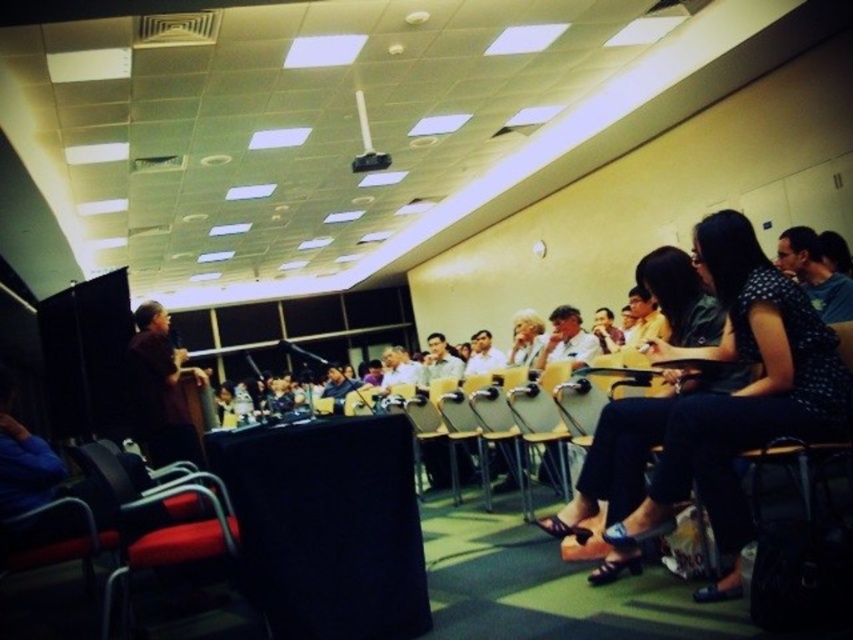
You are attending a meeting in this room and notice both the polka dot blouse at center and the red fabric chair at lower left. From your perspective sitting in the front row, which object is positioned to the right of the other?

The polka dot blouse at center is to the right of the red fabric chair at lower left.

You are sitting in the audience at the back of the conference room and see both the polka dot blouse at center and the brown shirt at left. Which one is closer to you?

The brown shirt at left is closer to you because the polka dot blouse at center is in front of it, making the brown shirt at left appear behind.

In the scene shown: You are standing at the entrance of the conference room and want to take a seat in the red fabric chair at lower left. Based on the coordinates given, can you determine if this chair is located near the front or back of the room?

The red fabric chair at lower left is located at coordinates point (x=160, y=520). Since the lower left corner of the room is near the front, the chair is positioned near the front of the room.